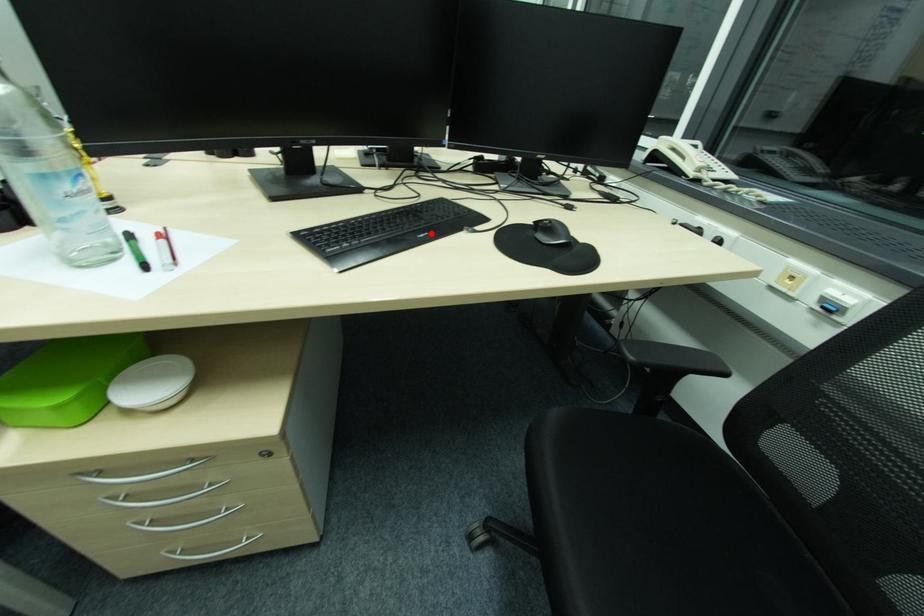
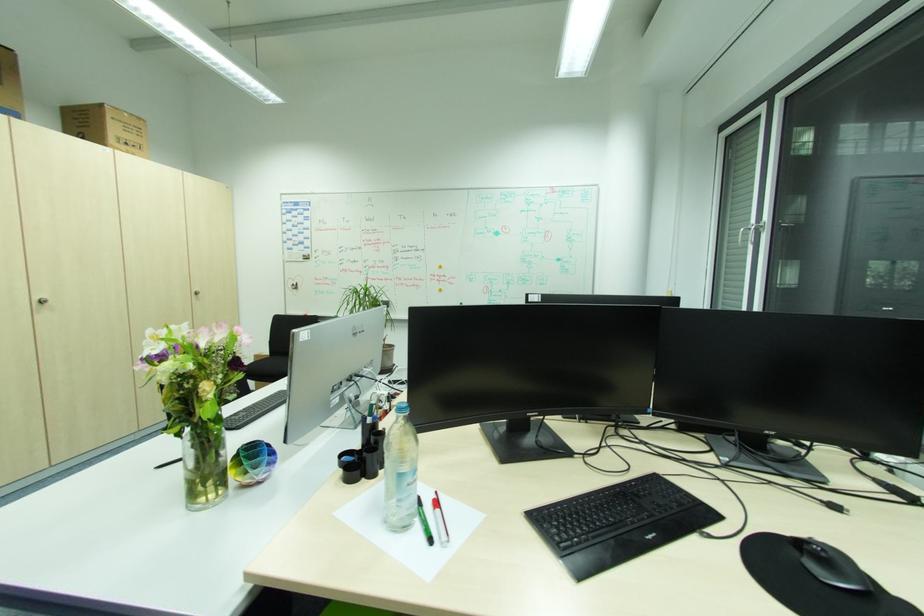
The point at the highlighted location is marked in the first image. Where is the corresponding point in the second image?

(660, 533)